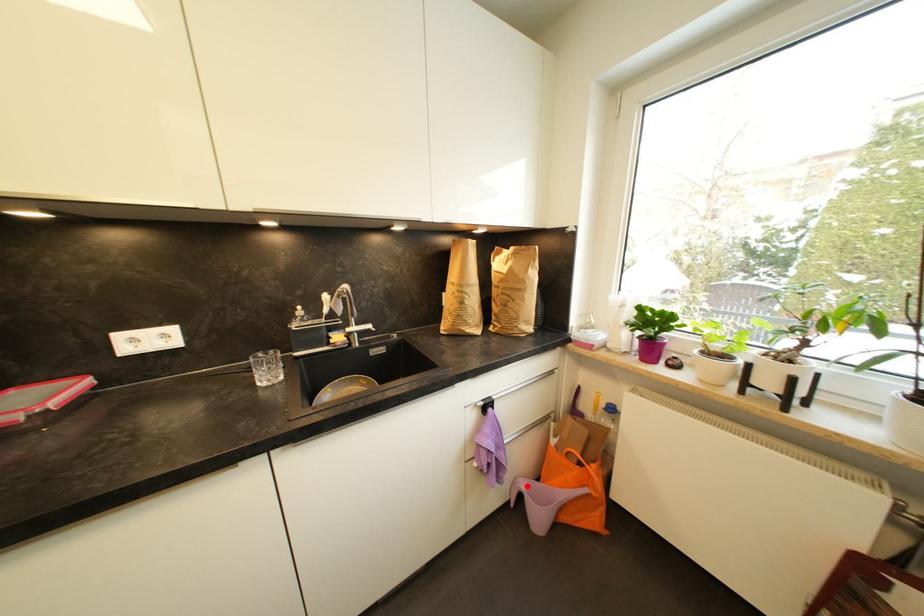
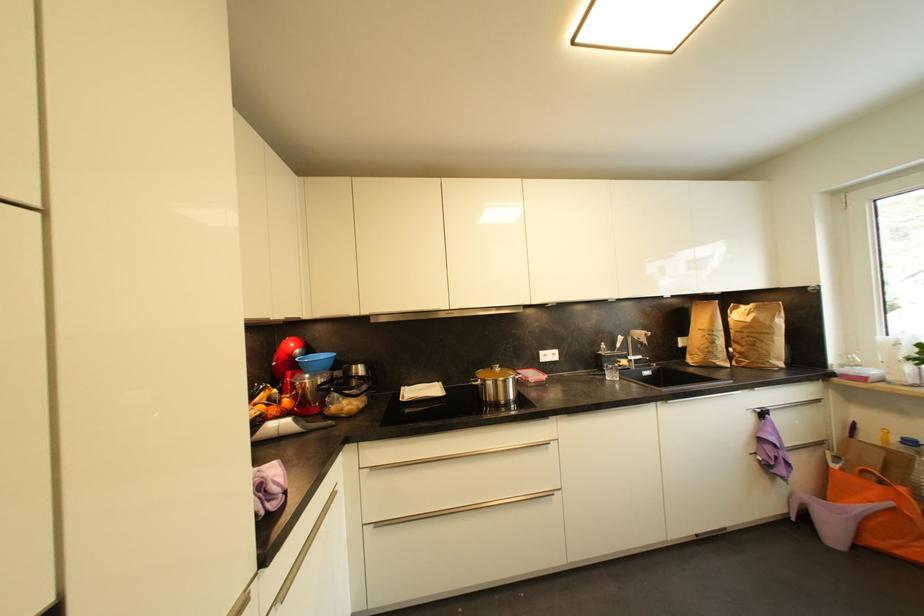
Where in the second image is the point corresponding to the highlighted location from the first image?

(811, 498)